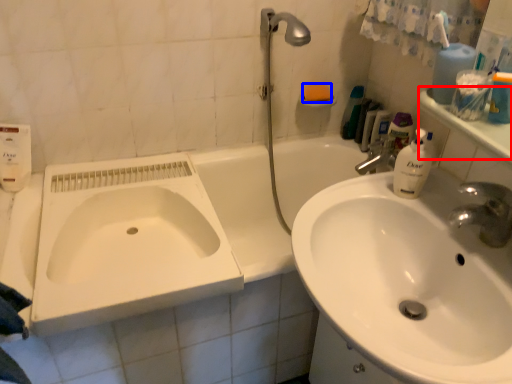
Question: Which of the following is the closest to the observer, counter top (highlighted by a red box) or soap (highlighted by a blue box)?

Choices:
 (A) counter top
 (B) soap

Answer: (A)